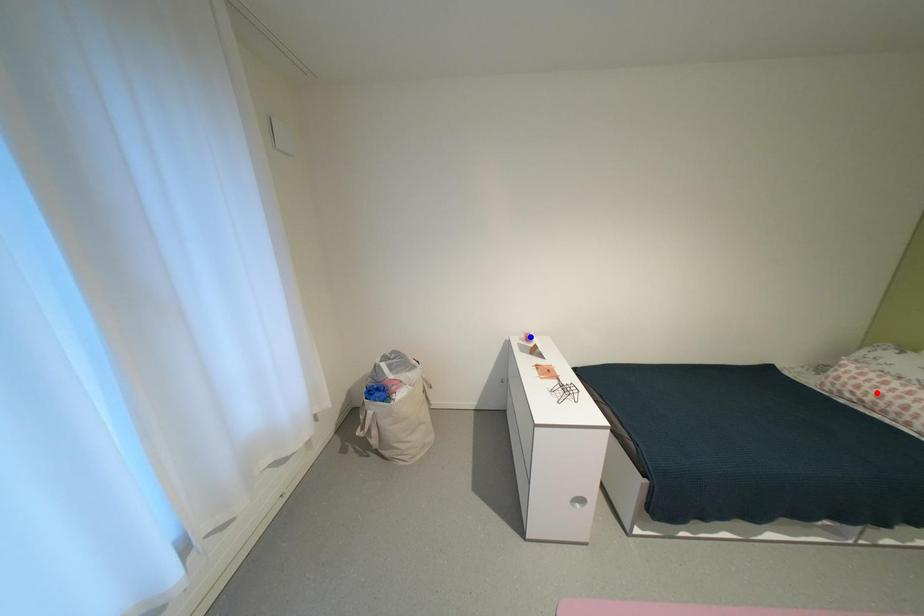
Question: Which of the two points in the image is closer to the camera?

Choices:
 (A) Blue point is closer.
 (B) Red point is closer.

Answer: (B)